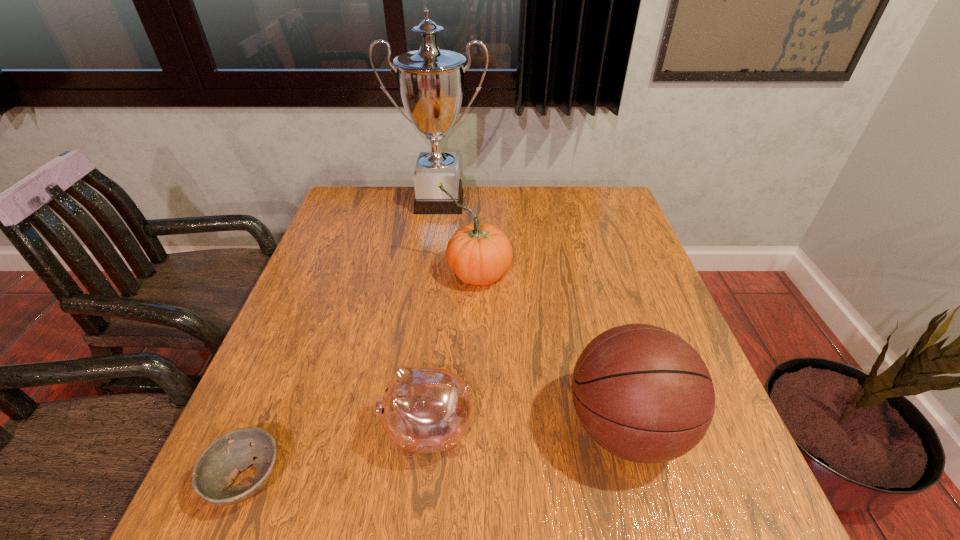
This screenshot has width=960, height=540. In order to click on free region that satisfies the following two spatial constraints: 1. at the front view of the pumpkin; 2. on the left side of the trophy cup in this screenshot , I will do `click(429, 273)`.

This screenshot has width=960, height=540. In order to click on vacant space that satisfies the following two spatial constraints: 1. at the front view of the second farthest object; 2. on the right side of the tallest object in this screenshot , I will do (429, 273).